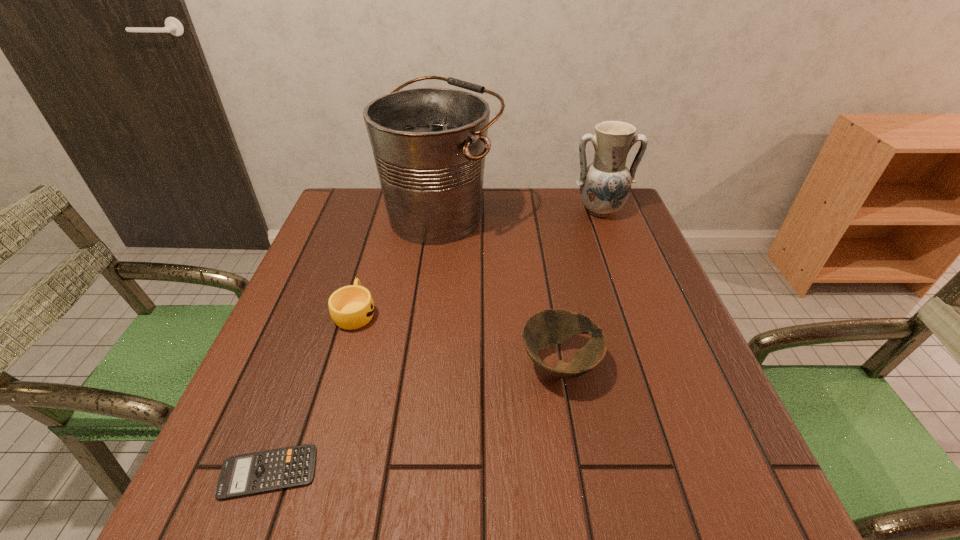
Identify which object is the second nearest to the bucket. Please provide its 2D coordinates. Your answer should be formatted as a tuple, i.e. [(x, y)], where the tuple contains the x and y coordinates of a point satisfying the conditions above.

[(605, 185)]

Locate an element on the screen. The height and width of the screenshot is (540, 960). object that is the closest to the nearest object is located at coordinates (351, 307).

What are the coordinates of `vacant area in the image that satisfies the following two spatial constraints: 1. on the front side of the fourth object from left to right; 2. on the left side of the fourth tallest object` in the screenshot? It's located at (341, 364).

Find the location of a particular element. This screenshot has width=960, height=540. free space in the image that satisfies the following two spatial constraints: 1. on the front side of the second nearest object; 2. on the left side of the bucket is located at coordinates (424, 364).

You are a GUI agent. You are given a task and a screenshot of the screen. Output one action in this format:
    pyautogui.click(x=<x>, y=<y>)
    Task: Click on the vacant space that satisfies the following two spatial constraints: 1. on the back side of the tallest object; 2. on the left side of the shortest object
    Image resolution: width=960 pixels, height=540 pixels.
    Given the screenshot: What is the action you would take?
    pyautogui.click(x=362, y=215)

Locate an element on the screen. This screenshot has height=540, width=960. free location that satisfies the following two spatial constraints: 1. on the front side of the bowl; 2. on the left side of the tallest object is located at coordinates (424, 364).